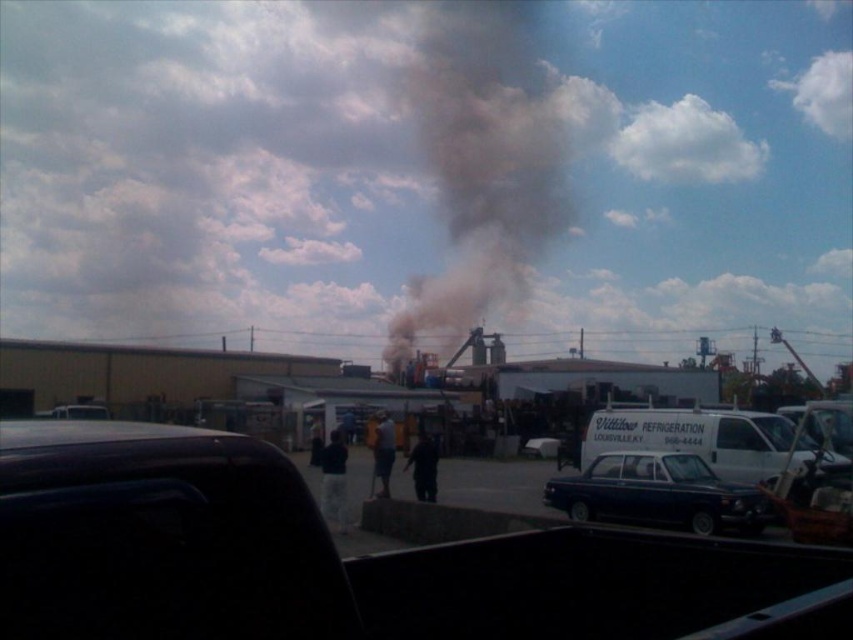
Does black smoke at center appear over dark gray smoke at center?

Indeed, black smoke at center is positioned over dark gray smoke at center.

Describe the element at coordinates (421, 173) in the screenshot. I see `black smoke at center` at that location.

Where is `black smoke at center`? black smoke at center is located at coordinates (421, 173).

Can you confirm if shiny blue sedan at center is positioned below shiny black sedan at center?

No, shiny blue sedan at center is not below shiny black sedan at center.

Is point (607, 481) in front of point (538, 440)?

Yes, it is in front of point (538, 440).

I want to click on shiny blue sedan at center, so click(x=659, y=493).

The width and height of the screenshot is (853, 640). Identify the location of shiny blue sedan at center. (659, 493).

Is dark gray smoke at center above shiny blue sedan at center?

Indeed, dark gray smoke at center is positioned over shiny blue sedan at center.

What do you see at coordinates (482, 161) in the screenshot? I see `dark gray smoke at center` at bounding box center [482, 161].

What are the coordinates of `dark gray smoke at center` in the screenshot? It's located at (482, 161).